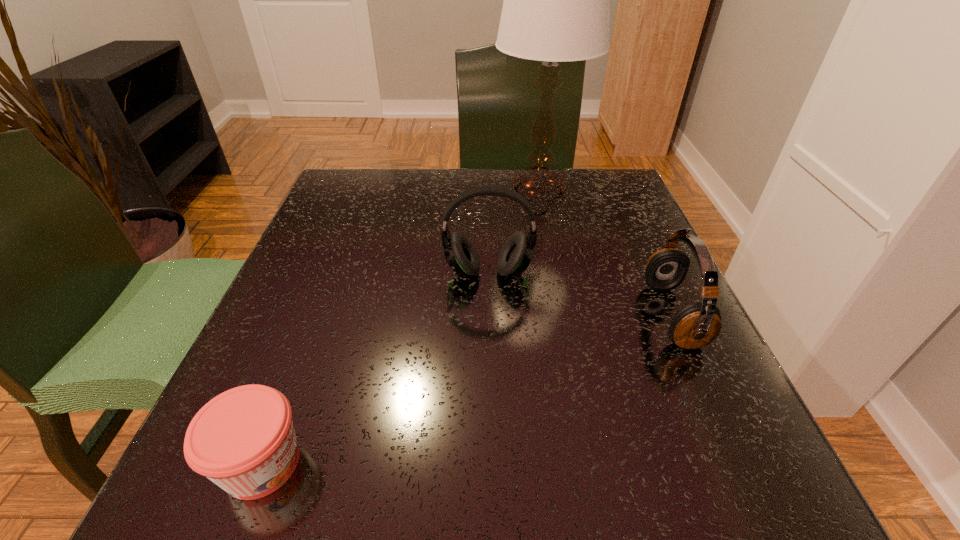
Identify the location of the tallest object. (556, 8).

Where is `table lamp`? The width and height of the screenshot is (960, 540). table lamp is located at coordinates (556, 8).

Where is `the taller headset`? the taller headset is located at coordinates (516, 255).

Image resolution: width=960 pixels, height=540 pixels. What are the coordinates of `the left headset` in the screenshot? It's located at (516, 255).

You are a GUI agent. You are given a task and a screenshot of the screen. Output one action in this format:
    pyautogui.click(x=<x>, y=<y>)
    Task: Click on the third tallest object
    This screenshot has height=540, width=960.
    Given the screenshot: What is the action you would take?
    coord(696,325)

Identify the location of the shorter headset. This screenshot has width=960, height=540. (696, 325).

Locate an element on the screen. This screenshot has height=540, width=960. the nearest object is located at coordinates (243, 440).

The width and height of the screenshot is (960, 540). I want to click on the shortest object, so [243, 440].

The image size is (960, 540). Identify the location of vacant region located 0.330m on the front-facing side of the tallest object. (357, 191).

Locate an element on the screen. This screenshot has width=960, height=540. free space located on the front-facing side of the tallest object is located at coordinates (427, 191).